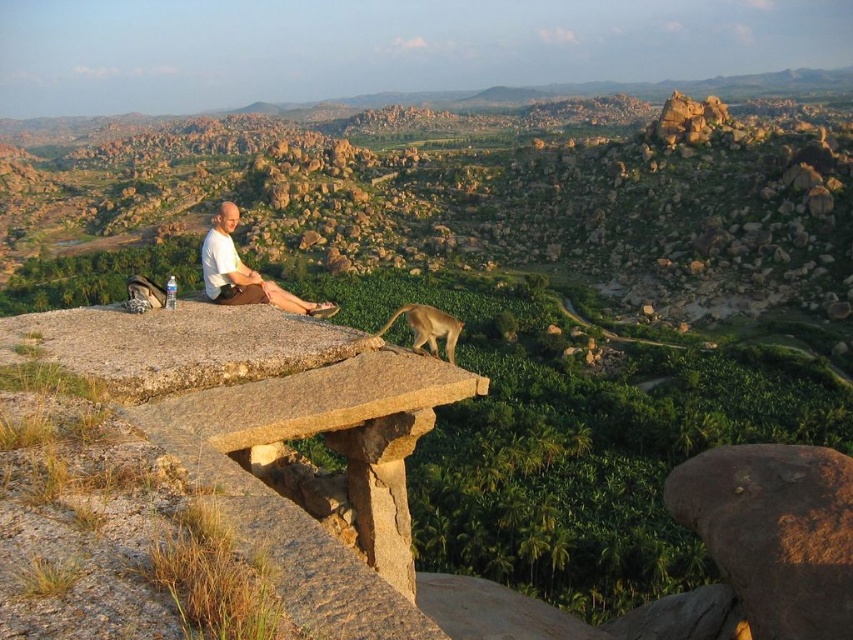
Is the position of brown rough stone at lower right more distant than that of white matte shirt at center?

No, brown rough stone at lower right is closer to the viewer.

The image size is (853, 640). Describe the element at coordinates (775, 532) in the screenshot. I see `brown rough stone at lower right` at that location.

Which is behind, point (778, 460) or point (328, 305)?

Point (328, 305)

Where is `brown rough stone at lower right`? This screenshot has height=640, width=853. brown rough stone at lower right is located at coordinates (775, 532).

Describe the element at coordinates (775, 532) in the screenshot. The width and height of the screenshot is (853, 640). I see `brown rough stone at lower right` at that location.

Find the location of a particular element. This screenshot has height=640, width=853. brown rough stone at lower right is located at coordinates (775, 532).

Locate an element on the screen. This screenshot has width=853, height=640. brown rough stone at lower right is located at coordinates (775, 532).

Who is taller, white matte shirt at center or golden fur monkey at center?

With more height is white matte shirt at center.

Does white matte shirt at center appear under golden fur monkey at center?

No.

Between point (210, 248) and point (421, 307), which one is positioned behind?

The point (210, 248) is behind.

The height and width of the screenshot is (640, 853). I want to click on white matte shirt at center, so click(x=242, y=273).